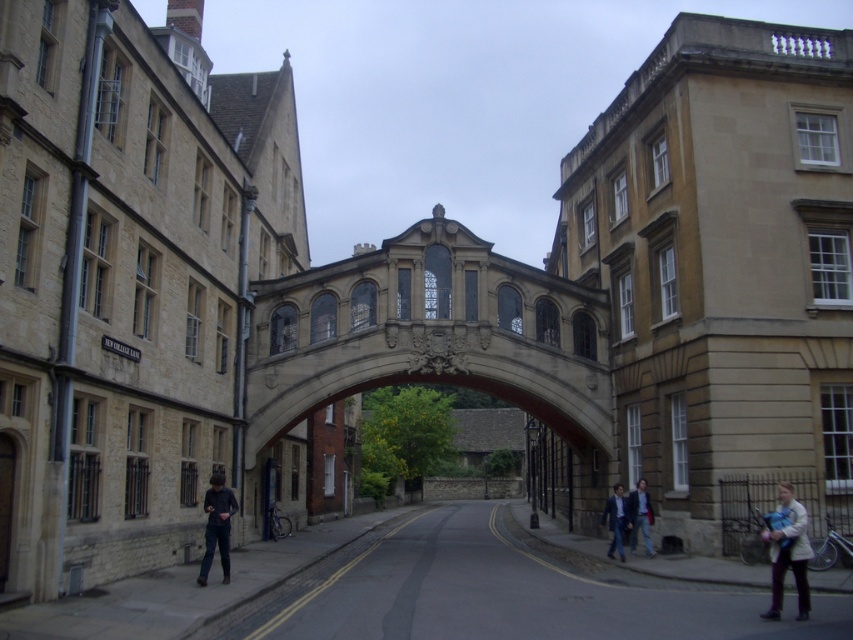
Question: Can you confirm if smooth stone alley at center is thinner than dark blue jeans at lower right?

Choices:
 (A) yes
 (B) no

Answer: (B)

Question: Which point is closer to the camera?

Choices:
 (A) dark blue jeans at lower left
 (B) stone arch bridge at center
 (C) white wool coat at lower right
 (D) dark blue jeans at lower right

Answer: (C)

Question: Where is stone arch bridge at center located in relation to light blue denim jacket at lower right in the image?

Choices:
 (A) above
 (B) below

Answer: (A)

Question: Which of the following is the closest to the observer?

Choices:
 (A) dark blue jeans at lower right
 (B) dark blue jeans at lower left
 (C) light blue denim jacket at lower right

Answer: (B)

Question: Which of these objects is positioned farthest from the smooth stone alley at center?

Choices:
 (A) stone arch bridge at center
 (B) dark blue jeans at lower left
 (C) white wool coat at lower right

Answer: (A)

Question: Does smooth stone alley at center appear on the right side of white wool coat at lower right?

Choices:
 (A) yes
 (B) no

Answer: (B)